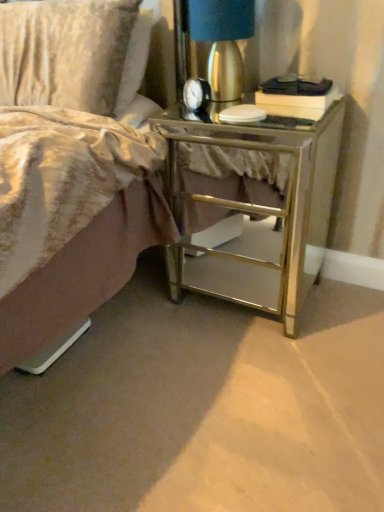
This screenshot has width=384, height=512. In order to click on free spot in front of mirrored glass nightstand at lower right in this screenshot , I will do `click(258, 377)`.